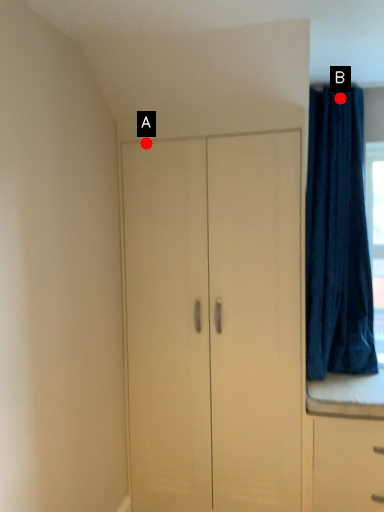
Question: Two points are circled on the image, labeled by A and B beside each circle. Which point is farther from the camera taking this photo?

Choices:
 (A) A is further
 (B) B is further

Answer: (B)